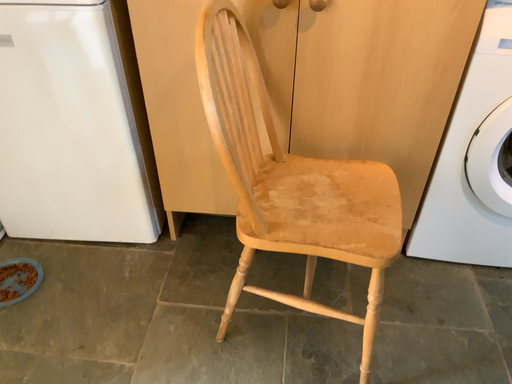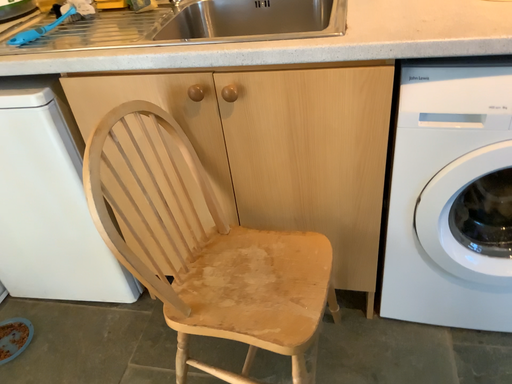
Question: How did the camera likely rotate when shooting the video?

Choices:
 (A) rotated left
 (B) rotated right

Answer: (A)